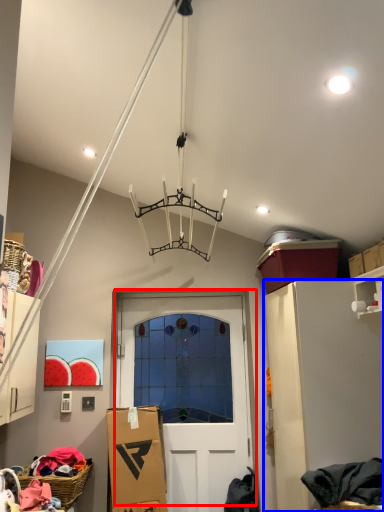
Question: Which object appears closest to the camera in this image, door (highlighted by a red box) or cabinetry (highlighted by a blue box)?

Choices:
 (A) door
 (B) cabinetry

Answer: (B)